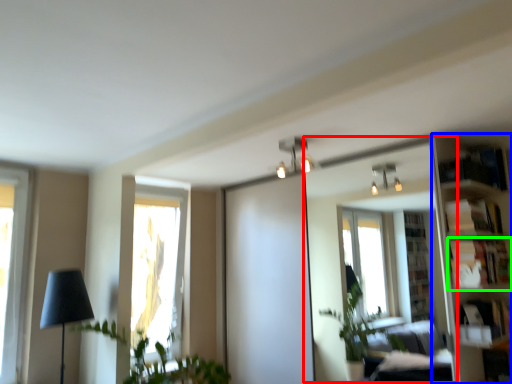
Question: Which is farther away from mirror (highlighted by a red box)? bookshelf (highlighted by a blue box) or shelf (highlighted by a green box)?

Choices:
 (A) bookshelf
 (B) shelf

Answer: (B)